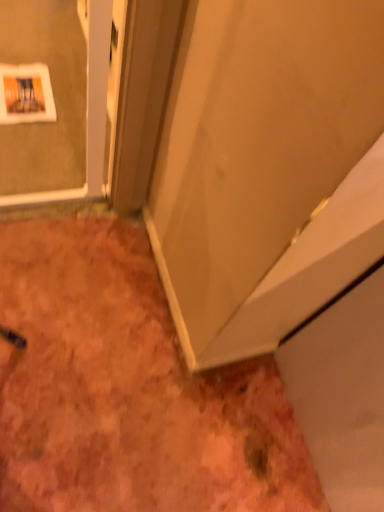
Question: From their relative heights in the image, would you say brown textured carpet at lower left is taller or shorter than matte white door at center?

Choices:
 (A) tall
 (B) short

Answer: (B)

Question: From a real-world perspective, is brown textured carpet at lower left above or below matte white door at center?

Choices:
 (A) below
 (B) above

Answer: (A)

Question: Is brown textured carpet at lower left inside the boundaries of matte white door at center, or outside?

Choices:
 (A) inside
 (B) outside

Answer: (B)

Question: From the image's perspective, is matte white door at center above or below brown textured carpet at lower left?

Choices:
 (A) above
 (B) below

Answer: (A)

Question: Considering the relative positions of matte white door at center and brown textured carpet at lower left in the image provided, is matte white door at center to the left or to the right of brown textured carpet at lower left?

Choices:
 (A) right
 (B) left

Answer: (A)

Question: Is matte white door at center in front of or behind brown textured carpet at lower left in the image?

Choices:
 (A) front
 (B) behind

Answer: (A)

Question: Choose the correct answer: Is matte white door at center inside brown textured carpet at lower left or outside it?

Choices:
 (A) inside
 (B) outside

Answer: (B)